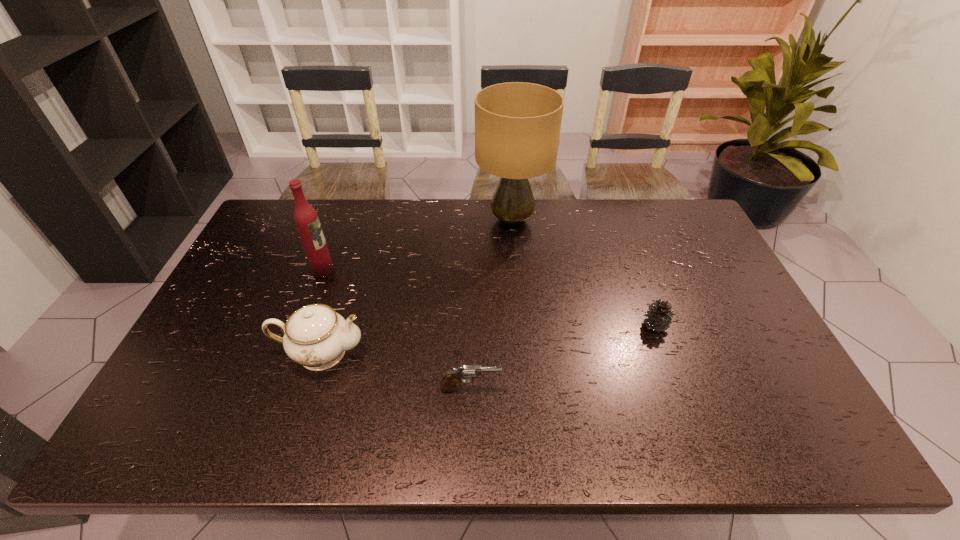
Find the location of `vacant region between the tallest object and the chinaware`. vacant region between the tallest object and the chinaware is located at coordinates (417, 286).

This screenshot has width=960, height=540. I want to click on free space that is in between the pistol and the chinaware, so click(x=396, y=370).

Where is `vacant area between the pistol and the second farthest object`? This screenshot has width=960, height=540. vacant area between the pistol and the second farthest object is located at coordinates (396, 329).

Where is `vacant region between the tallest object and the rightmost object`? The height and width of the screenshot is (540, 960). vacant region between the tallest object and the rightmost object is located at coordinates (584, 272).

Identify the location of empty location between the farthest object and the rightmost object. (584, 272).

Where is `vacant space that's between the second farthest object and the pinecone`? This screenshot has width=960, height=540. vacant space that's between the second farthest object and the pinecone is located at coordinates coord(490,298).

The height and width of the screenshot is (540, 960). Find the location of `free spot between the nearest object and the pinecone`. free spot between the nearest object and the pinecone is located at coordinates (563, 357).

At what (x,y) coordinates should I click in order to perform the action: click on free space between the farthest object and the pistol. Please return your answer as a coordinate pair (x, y). The width and height of the screenshot is (960, 540). Looking at the image, I should click on (492, 304).

Find the location of a particular element. This screenshot has height=540, width=960. the fourth closest object to the second farthest object is located at coordinates (659, 316).

Where is `the closest object to the nearest object`? Image resolution: width=960 pixels, height=540 pixels. the closest object to the nearest object is located at coordinates (316, 336).